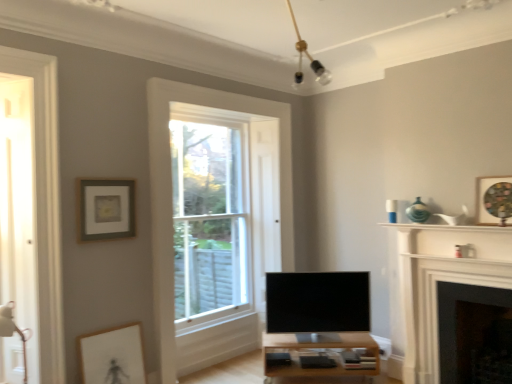
Question: Is silver metallic tv at center to the right of matte gray picture frame at upper left, which appears as the third picture frame when viewed from the right, from the viewer's perspective?

Choices:
 (A) no
 (B) yes

Answer: (B)

Question: Is the depth of silver metallic tv at center greater than that of matte gray picture frame at upper left, which appears as the third picture frame when viewed from the right?

Choices:
 (A) yes
 (B) no

Answer: (A)

Question: Is silver metallic tv at center positioned far away from matte gray picture frame at upper left, the 2th picture frame positioned from the bottom?

Choices:
 (A) yes
 (B) no

Answer: (A)

Question: From a real-world perspective, is silver metallic tv at center located beneath matte gray picture frame at upper left, the 2th picture frame positioned from the bottom?

Choices:
 (A) no
 (B) yes

Answer: (B)

Question: From the image's perspective, does silver metallic tv at center appear higher than matte gray picture frame at upper left, the first picture frame when ordered from left to right?

Choices:
 (A) no
 (B) yes

Answer: (A)

Question: Does silver metallic tv at center contain matte gray picture frame at upper left, the 2th picture frame positioned from the bottom?

Choices:
 (A) no
 (B) yes

Answer: (A)

Question: Considering the relative sizes of wooden textured picture frame at upper right, which ranks as the 1th picture frame in right-to-left order, and matte gray picture frame at upper left, the 2th picture frame positioned from the bottom, in the image provided, is wooden textured picture frame at upper right, which ranks as the 1th picture frame in right-to-left order, wider than matte gray picture frame at upper left, the 2th picture frame positioned from the bottom,?

Choices:
 (A) yes
 (B) no

Answer: (A)

Question: Is wooden textured picture frame at upper right, which ranks as the 3th picture frame in left-to-right order, not close to matte gray picture frame at upper left, the first picture frame when ordered from left to right?

Choices:
 (A) yes
 (B) no

Answer: (A)

Question: From the image's perspective, is wooden textured picture frame at upper right, which is the first picture frame in top-to-bottom order, above matte gray picture frame at upper left, which appears as the third picture frame when viewed from the right?

Choices:
 (A) yes
 (B) no

Answer: (A)

Question: Does wooden textured picture frame at upper right, which ranks as the 1th picture frame in right-to-left order, have a greater height compared to matte gray picture frame at upper left, arranged as the 2th picture frame when viewed from the top?

Choices:
 (A) yes
 (B) no

Answer: (B)

Question: Is matte gray picture frame at upper left, the first picture frame when ordered from left to right, located within wooden textured picture frame at upper right, the 3th picture frame positioned from the bottom?

Choices:
 (A) yes
 (B) no

Answer: (B)

Question: Is wooden textured picture frame at upper right, which ranks as the 3th picture frame in left-to-right order, not inside matte gray picture frame at upper left, the 2th picture frame positioned from the bottom?

Choices:
 (A) yes
 (B) no

Answer: (A)

Question: Could matte white picture frame at lower left, which is the 3th picture frame in top-to-bottom order, be considered to be inside silver metallic tv at center?

Choices:
 (A) yes
 (B) no

Answer: (B)